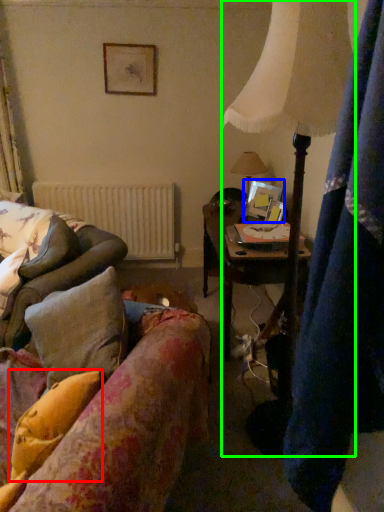
Question: Which object is positioned farthest from pillow (highlighted by a red box)? Select from picture frame (highlighted by a blue box) and lamp (highlighted by a green box).

Choices:
 (A) picture frame
 (B) lamp

Answer: (A)